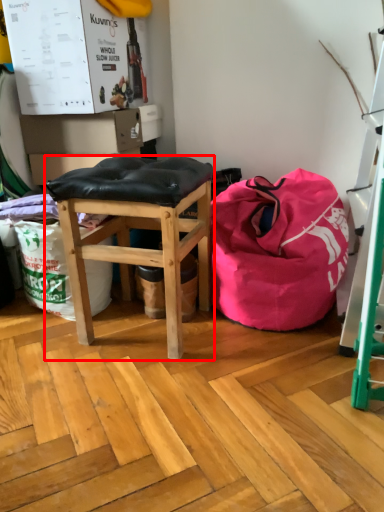
Question: Where is stool (annotated by the red box) located in relation to bean bag chair in the image?

Choices:
 (A) right
 (B) left

Answer: (B)